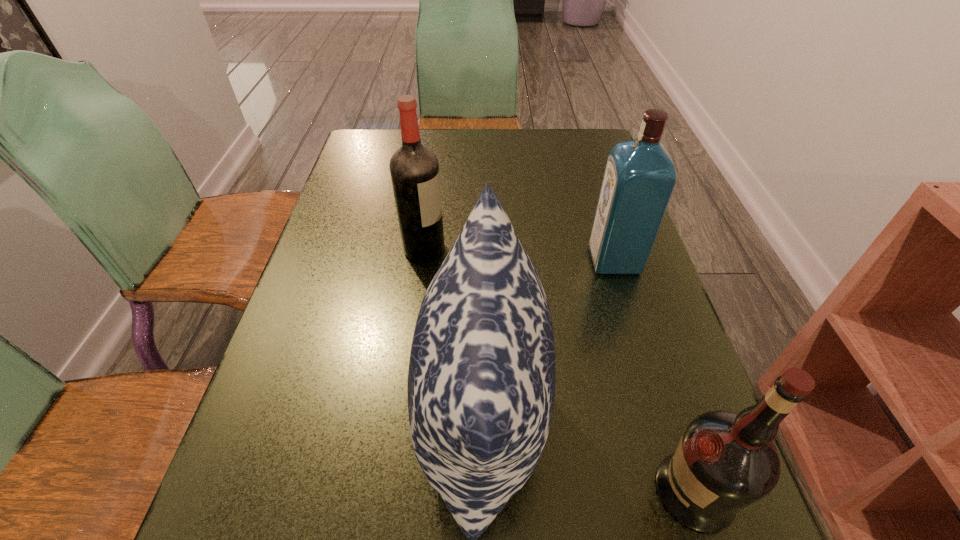
Image resolution: width=960 pixels, height=540 pixels. In the image, there is a desktop. In order to click on vacant space at the far right corner in this screenshot , I will do tap(579, 137).

The height and width of the screenshot is (540, 960). I want to click on the third closest object to the leftmost liquor, so click(725, 461).

Locate which object ranks in proximity to the nearest liquor. Please provide its 2D coordinates. Your answer should be formatted as a tuple, i.e. [(x, y)], where the tuple contains the x and y coordinates of a point satisfying the conditions above.

[(482, 373)]

Locate an element on the screen. liquor that is the second closest to the leftmost liquor is located at coordinates (725, 461).

Locate which liquor is the second closest to the nearest liquor. Please provide its 2D coordinates. Your answer should be formatted as a tuple, i.e. [(x, y)], where the tuple contains the x and y coordinates of a point satisfying the conditions above.

[(414, 168)]